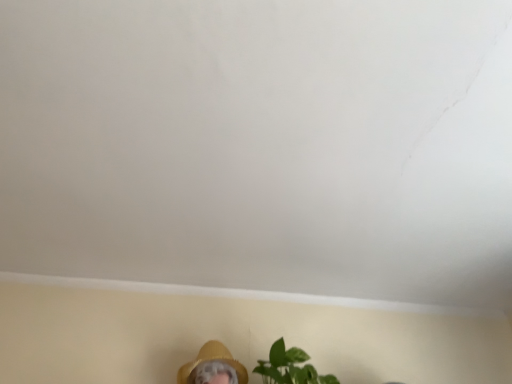
Image resolution: width=512 pixels, height=384 pixels. What do you see at coordinates (290, 367) in the screenshot? I see `green matte plant at lower center` at bounding box center [290, 367].

In order to face green matte plant at lower center, should I rotate leftwards or rightwards?

A 5.211 degree turn to the right will do.

Find the location of a particular element. The width and height of the screenshot is (512, 384). green matte plant at lower center is located at coordinates (290, 367).

What do you see at coordinates (213, 367) in the screenshot?
I see `yellow straw hat at lower center` at bounding box center [213, 367].

You are a GUI agent. You are given a task and a screenshot of the screen. Output one action in this format:
    pyautogui.click(x=<x>, y=<y>)
    Task: Click on the yellow straw hat at lower center
    
    Given the screenshot: What is the action you would take?
    pyautogui.click(x=213, y=367)

Where is `green matte plant at lower center`? green matte plant at lower center is located at coordinates (290, 367).

Between green matte plant at lower center and yellow straw hat at lower center, which one appears on the left side from the viewer's perspective?

yellow straw hat at lower center.

Which is in front, green matte plant at lower center or yellow straw hat at lower center?

green matte plant at lower center is more forward.

Considering the points (275, 374) and (183, 366), which point is in front, point (275, 374) or point (183, 366)?

Point (275, 374)

From the image's perspective, is green matte plant at lower center located above or below yellow straw hat at lower center?

Based on their image positions, green matte plant at lower center is located above yellow straw hat at lower center.

From a real-world perspective, is green matte plant at lower center physically above yellow straw hat at lower center?

No, from a real-world perspective, green matte plant at lower center is not over yellow straw hat at lower center

Looking at this image, considering the sizes of green matte plant at lower center and yellow straw hat at lower center in the image, is green matte plant at lower center wider or thinner than yellow straw hat at lower center?

Clearly, green matte plant at lower center has more width compared to yellow straw hat at lower center.

Considering the sizes of objects green matte plant at lower center and yellow straw hat at lower center in the image provided, who is taller, green matte plant at lower center or yellow straw hat at lower center?

green matte plant at lower center.

Considering the sizes of objects green matte plant at lower center and yellow straw hat at lower center in the image provided, who is bigger, green matte plant at lower center or yellow straw hat at lower center?

Bigger between the two is green matte plant at lower center.

Is green matte plant at lower center completely or partially outside of yellow straw hat at lower center?

Absolutely, green matte plant at lower center is external to yellow straw hat at lower center.

Can you see green matte plant at lower center touching yellow straw hat at lower center?

There is a gap between green matte plant at lower center and yellow straw hat at lower center.

Does green matte plant at lower center turn towards yellow straw hat at lower center?

No, green matte plant at lower center is not facing towards yellow straw hat at lower center.

Measure the distance between green matte plant at lower center and yellow straw hat at lower center.

green matte plant at lower center and yellow straw hat at lower center are 6.40 inches apart.

Locate an element on the screen. This screenshot has height=384, width=512. houseplant above the yellow straw hat at lower center (from the image's perspective) is located at coordinates (290, 367).

Looking at this image, considering the relative positions of yellow straw hat at lower center and green matte plant at lower center in the image provided, is yellow straw hat at lower center to the right of green matte plant at lower center from the viewer's perspective?

Incorrect, yellow straw hat at lower center is not on the right side of green matte plant at lower center.

Between yellow straw hat at lower center and green matte plant at lower center, which one is positioned behind?

yellow straw hat at lower center is further away from the camera.

Is point (234, 374) more distant than point (282, 370)?

That is True.

From the image's perspective, between yellow straw hat at lower center and green matte plant at lower center, which one is located above?

green matte plant at lower center, from the image's perspective.

From a real-world perspective, is yellow straw hat at lower center on green matte plant at lower center?

Yes, from a real-world perspective, yellow straw hat at lower center is above green matte plant at lower center.

Does yellow straw hat at lower center have a greater width compared to green matte plant at lower center?

In fact, yellow straw hat at lower center might be narrower than green matte plant at lower center.

Is yellow straw hat at lower center taller or shorter than green matte plant at lower center?

Considering their sizes, yellow straw hat at lower center has less height than green matte plant at lower center.

Considering the relative sizes of yellow straw hat at lower center and green matte plant at lower center in the image provided, is yellow straw hat at lower center smaller than green matte plant at lower center?

Indeed, yellow straw hat at lower center has a smaller size compared to green matte plant at lower center.

Is green matte plant at lower center located within yellow straw hat at lower center?

Actually, green matte plant at lower center is outside yellow straw hat at lower center.

Is yellow straw hat at lower center next to green matte plant at lower center and touching it?

yellow straw hat at lower center and green matte plant at lower center are clearly separated.

Could you tell me if yellow straw hat at lower center is facing green matte plant at lower center?

No, yellow straw hat at lower center is not turned towards green matte plant at lower center.

How many degrees apart are the facing directions of yellow straw hat at lower center and green matte plant at lower center?

The angle between the facing direction of yellow straw hat at lower center and the facing direction of green matte plant at lower center is 1.27 degrees.

Measure the distance from yellow straw hat at lower center to green matte plant at lower center.

They are 6.40 inches apart.

Locate an element on the screen. This screenshot has width=512, height=384. houseplant in front of the yellow straw hat at lower center is located at coordinates (290, 367).

Image resolution: width=512 pixels, height=384 pixels. What are the coordinates of `person that appears behind the green matte plant at lower center` in the screenshot? It's located at (213, 367).

At what (x,y) coordinates should I click in order to perform the action: click on person located above the green matte plant at lower center (from a real-world perspective). Please return your answer as a coordinate pair (x, y). The height and width of the screenshot is (384, 512). Looking at the image, I should click on (213, 367).